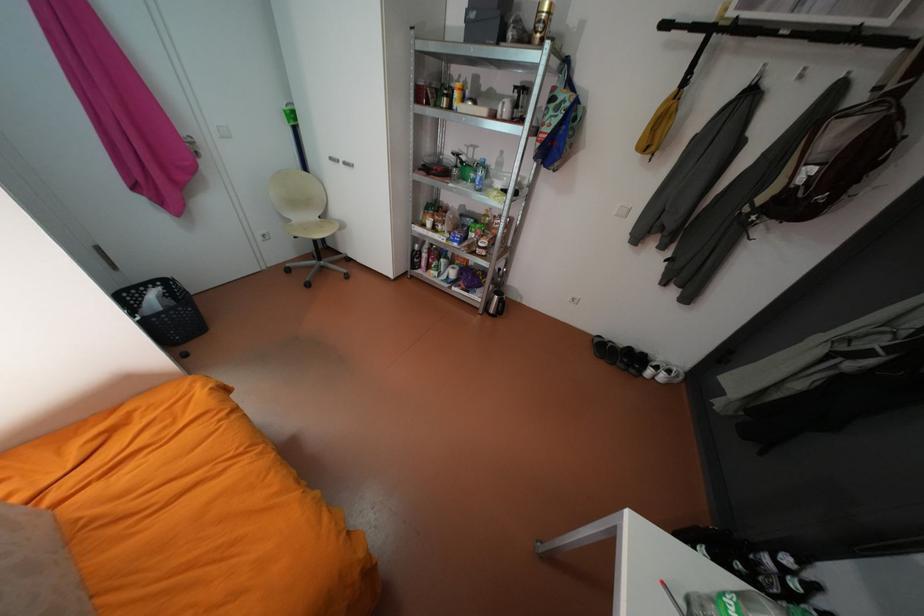
The height and width of the screenshot is (616, 924). Identify the location of silver door handle. (192, 148).